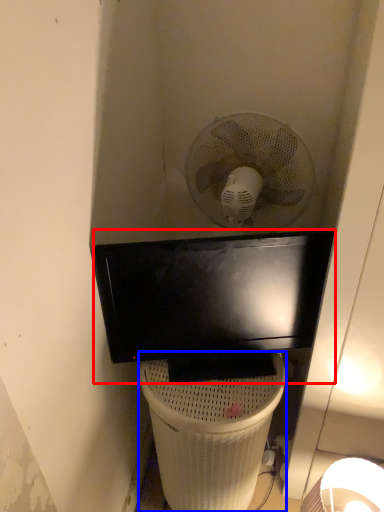
Question: Among these objects, which one is nearest to the camera, television (highlighted by a red box) or trash bin/can (highlighted by a blue box)?

Choices:
 (A) television
 (B) trash bin/can

Answer: (A)